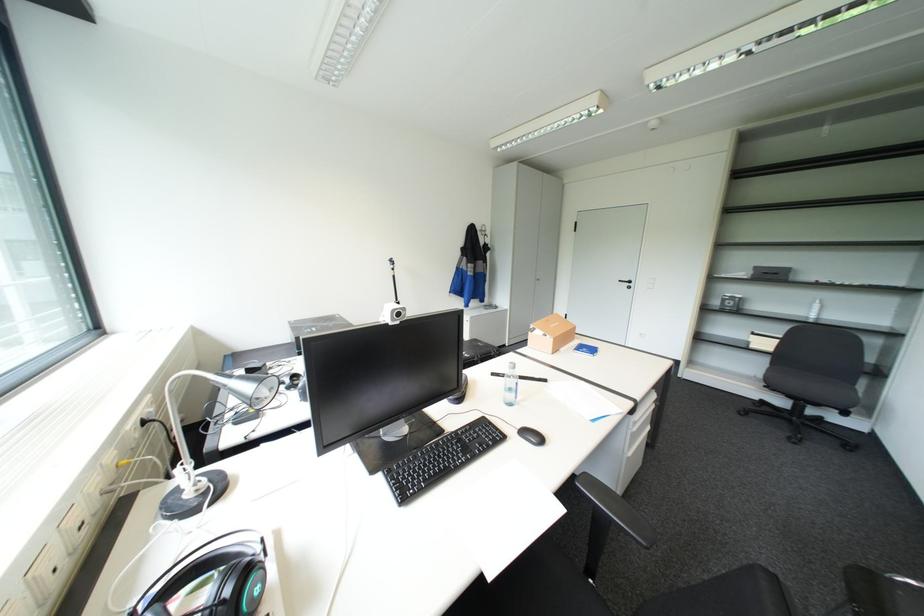
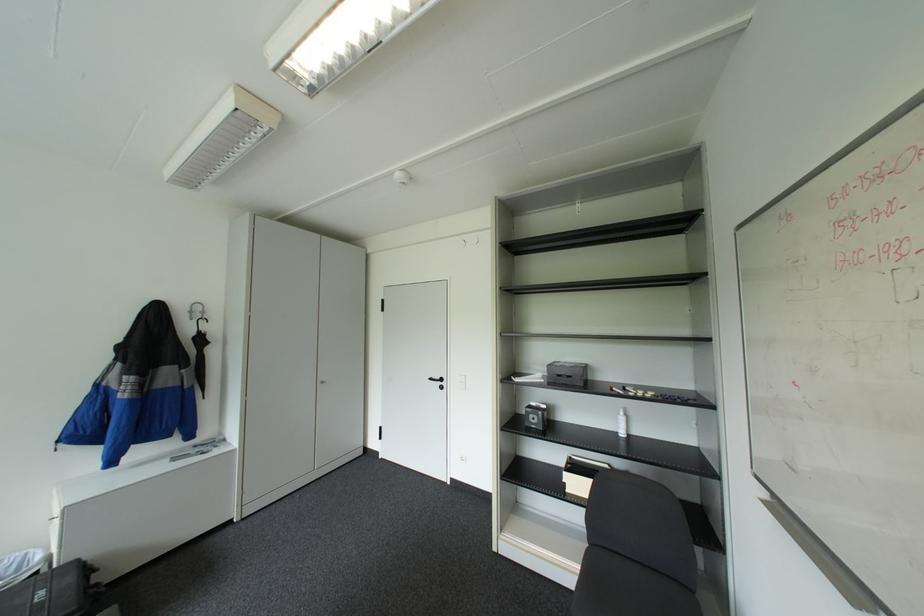
Find the pixel in the second image that matches [491,233] in the first image.

(200, 318)